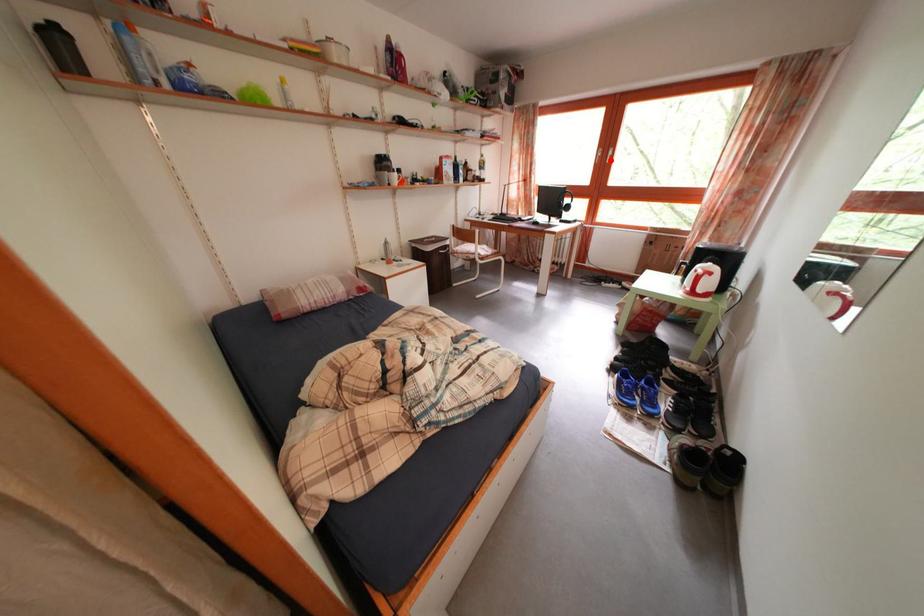
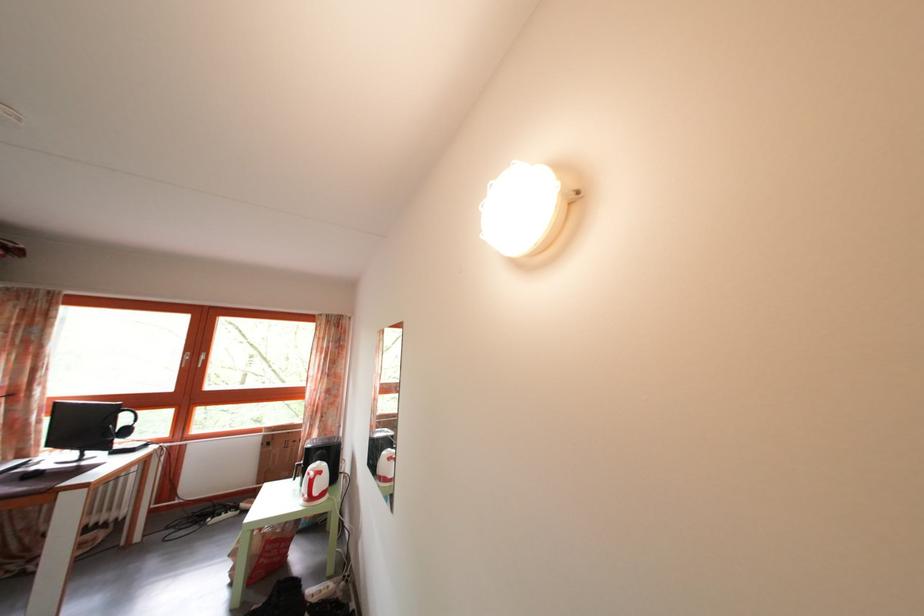
In the second image, find the point that corresponds to the highlighted location in the first image.

(199, 363)